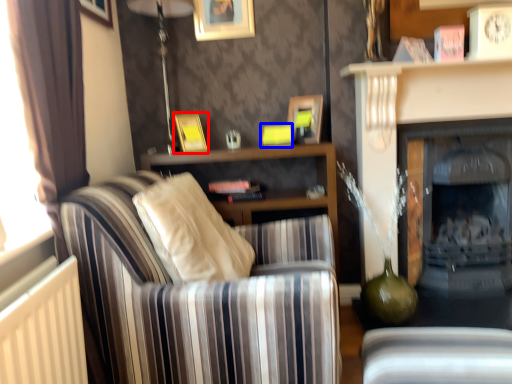
Question: Which point is closer to the camera, picture frame (highlighted by a red box) or picture frame (highlighted by a blue box)?

Choices:
 (A) picture frame
 (B) picture frame

Answer: (A)